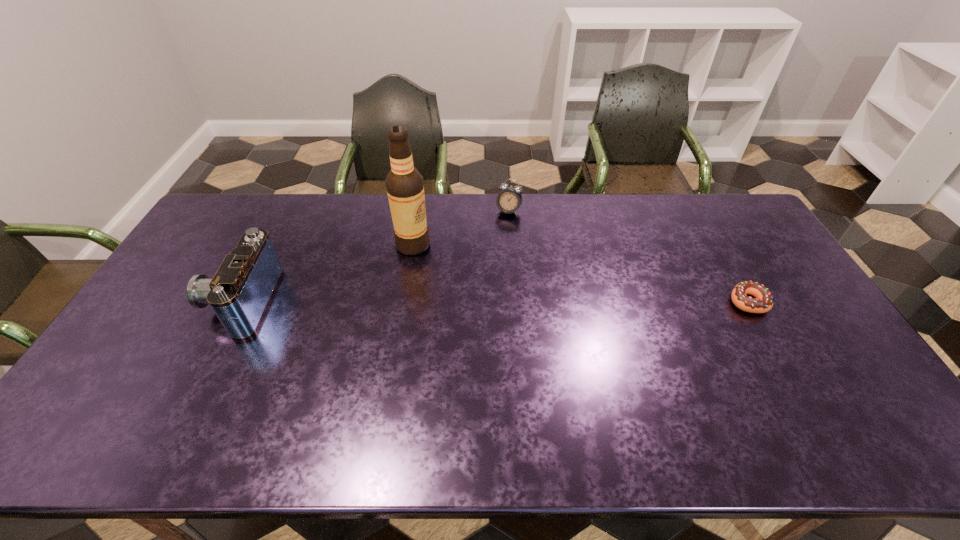
Find the location of a particular element. Image resolution: width=960 pixels, height=540 pixels. empty location between the tallest object and the doughnut is located at coordinates (580, 273).

You are a GUI agent. You are given a task and a screenshot of the screen. Output one action in this format:
    pyautogui.click(x=<x>, y=<y>)
    Task: Click on the unoccupied area between the alcohol and the third object from left to right
    The width and height of the screenshot is (960, 540).
    Given the screenshot: What is the action you would take?
    click(461, 228)

Find the location of `object that is the second closest to the third shortest object`. object that is the second closest to the third shortest object is located at coordinates (509, 200).

This screenshot has width=960, height=540. What are the coordinates of `the third closest object to the leftmost object` in the screenshot? It's located at (763, 301).